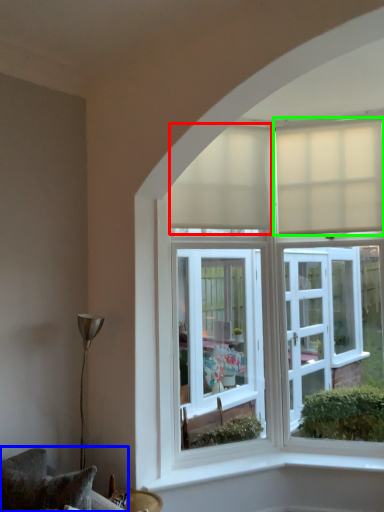
Question: Which object is the farthest from curtain (highlighted by a red box)? Choose among these: furniture (highlighted by a blue box) or curtain (highlighted by a green box).

Choices:
 (A) furniture
 (B) curtain

Answer: (A)